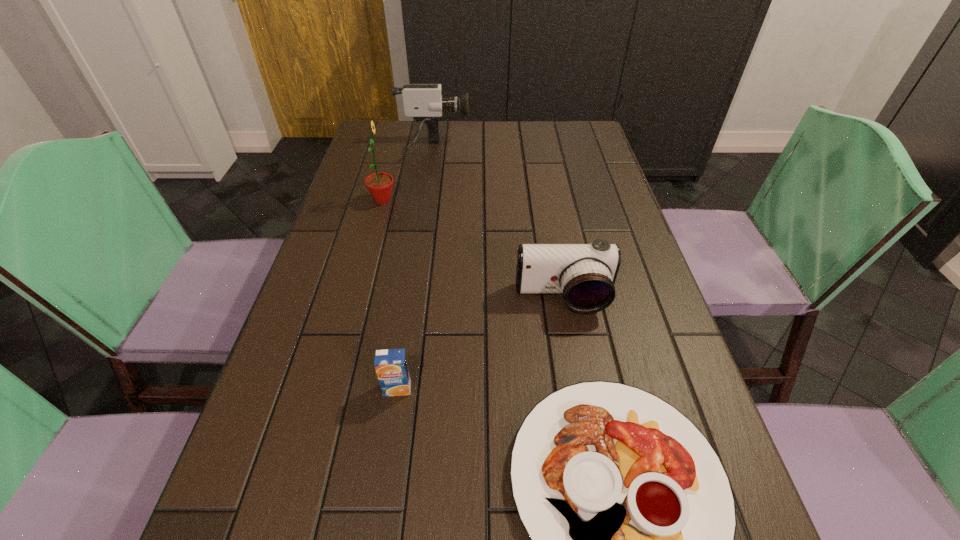
Identify the location of free space at the far right corner of the desktop. The image size is (960, 540). (587, 124).

Locate an element on the screen. empty location between the third nearest object and the orange_juice is located at coordinates (480, 344).

Locate an element on the screen. vacant point located between the second shortest object and the fourth nearest object is located at coordinates (390, 294).

Locate an element on the screen. This screenshot has width=960, height=540. unoccupied position between the orange_juice and the second tallest object is located at coordinates (415, 268).

Find the location of a particular element. Image resolution: width=960 pixels, height=540 pixels. free spot between the left camcorder and the second farthest object is located at coordinates (408, 174).

Locate an element on the screen. Image resolution: width=960 pixels, height=540 pixels. object that is the closest to the fourth tallest object is located at coordinates (631, 517).

Locate an element on the screen. the second closest object to the farther camcorder is located at coordinates (585, 274).

In order to click on free location that satisfies the following two spatial constraints: 1. on the face of the orange_juice; 2. on the left side of the tallest object in this screenshot , I will do `click(332, 388)`.

The image size is (960, 540). Identify the location of free space in the image that satisfies the following two spatial constraints: 1. on the face of the fourth nearest object; 2. on the right side of the orange_juice. (332, 388).